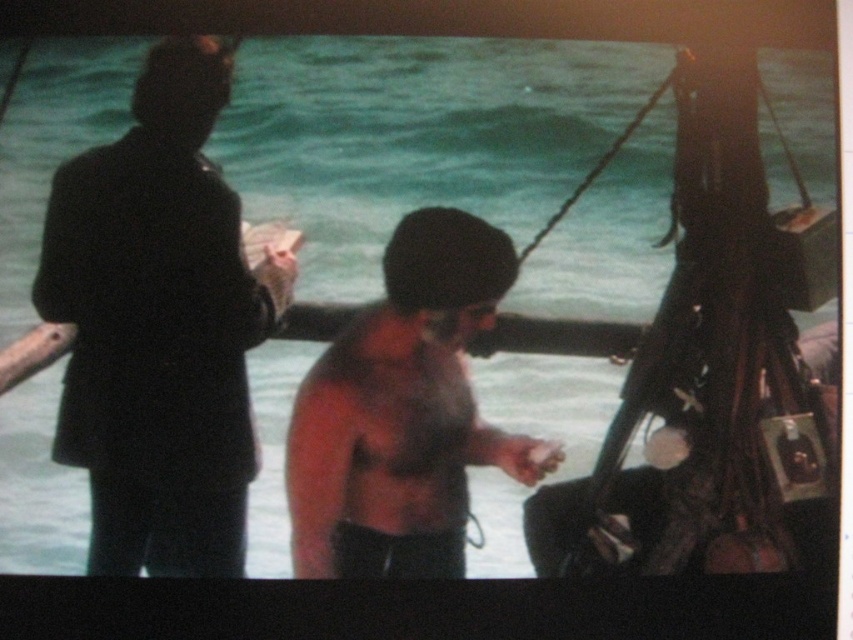
Question: Which object appears closest to the camera in this image?

Choices:
 (A) black matte suit at left
 (B) shiny skin torso at center

Answer: (A)

Question: Which point is farther to the camera?

Choices:
 (A) black matte suit at left
 (B) shiny skin torso at center

Answer: (B)

Question: Is black matte suit at left bigger than shiny skin torso at center?

Choices:
 (A) no
 (B) yes

Answer: (B)

Question: Which object appears closest to the camera in this image?

Choices:
 (A) black matte suit at left
 (B) shiny skin torso at center

Answer: (A)

Question: Can you confirm if black matte suit at left is positioned above shiny skin torso at center?

Choices:
 (A) no
 (B) yes

Answer: (B)

Question: Can you confirm if black matte suit at left is thinner than shiny skin torso at center?

Choices:
 (A) yes
 (B) no

Answer: (A)